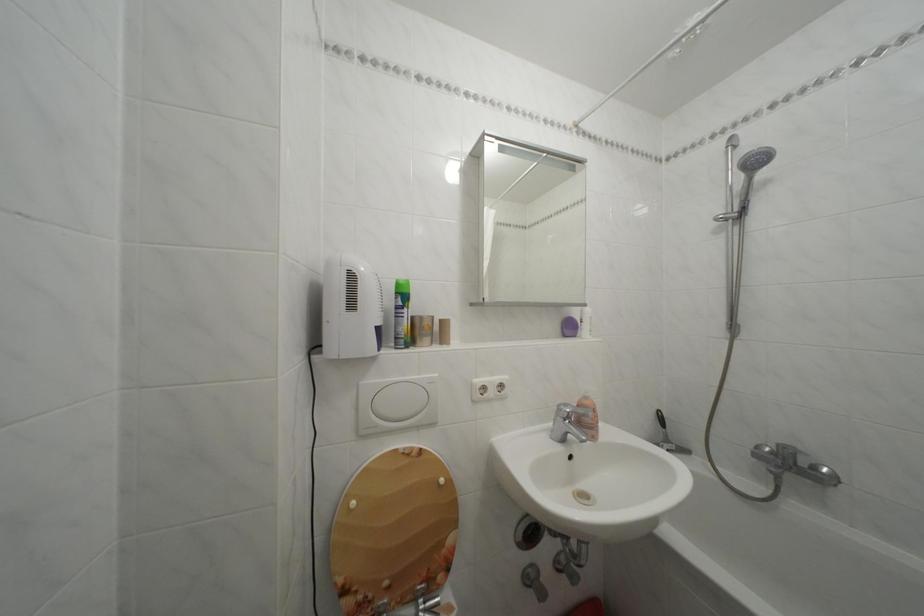
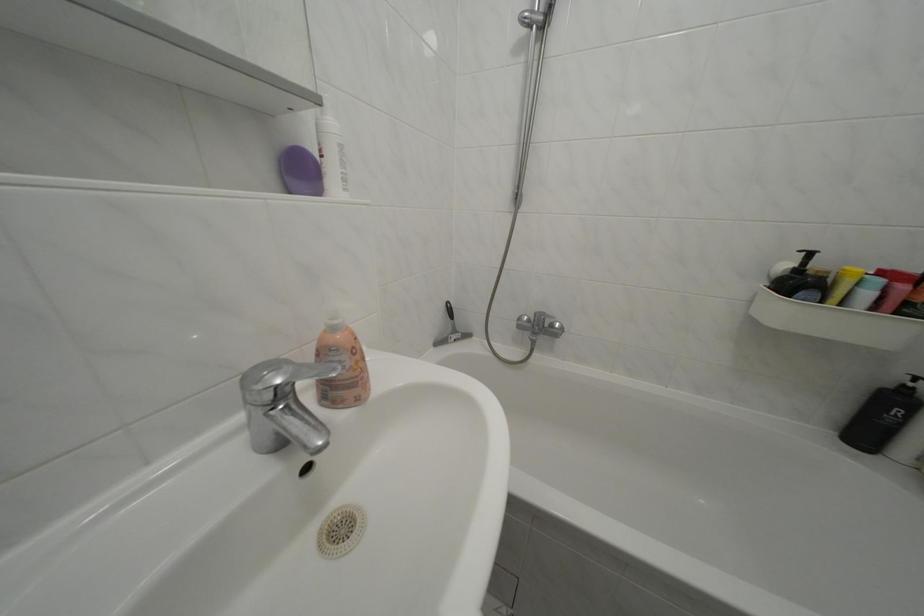
Based on the continuous images, in which direction is the camera rotating?

The camera rotated toward right-down.